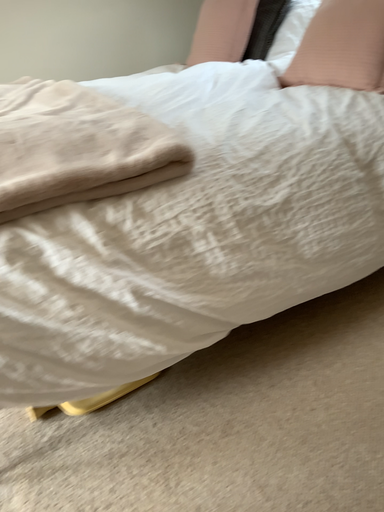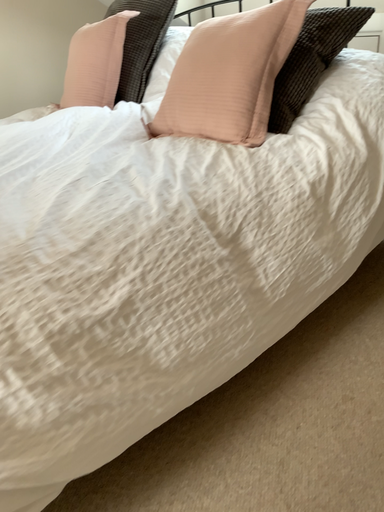
Question: How did the camera likely rotate when shooting the video?

Choices:
 (A) rotated right
 (B) rotated left

Answer: (A)